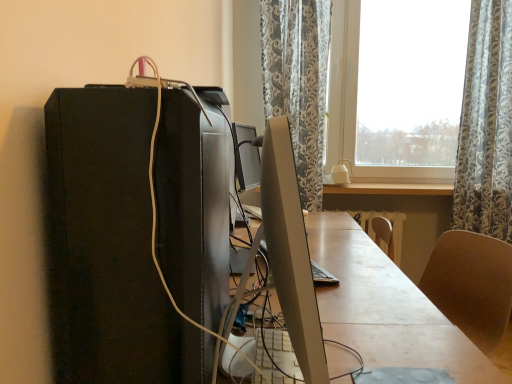
Question: Does point (421, 306) appear closer or farther from the camera than point (117, 97)?

Choices:
 (A) closer
 (B) farther

Answer: (B)

Question: Is smooth wooden desk at center spatially inside black matte computer tower at left, or outside of it?

Choices:
 (A) inside
 (B) outside

Answer: (B)

Question: Estimate the real-world distances between objects in this image. Which object is farther from the smooth wooden desk at center?

Choices:
 (A) satin silver monitor at center
 (B) black matte computer tower at left
 (C) patterned fabric curtain at upper right
 (D) light wood table at center

Answer: (C)

Question: Which object is positioned closest to the smooth wooden desk at center?

Choices:
 (A) light wood table at center
 (B) black matte computer tower at left
 (C) satin silver monitor at center
 (D) patterned fabric curtain at upper right

Answer: (C)